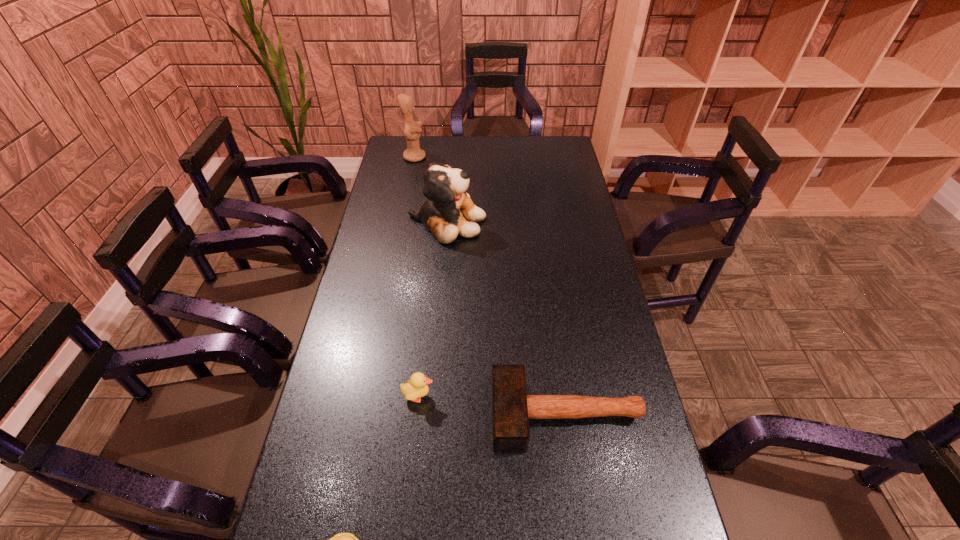
Find the location of a particular element. The width and height of the screenshot is (960, 540). free region located 0.060m on the hammer head face of the rightmost object is located at coordinates (468, 415).

Find the location of `vacant space located on the hammer head face of the rightmost object`. vacant space located on the hammer head face of the rightmost object is located at coordinates (352, 415).

Where is `object present at the far edge`? object present at the far edge is located at coordinates (413, 153).

Identify the location of figurine situated at the left edge. (413, 153).

Where is `puppy that is at the left edge`? puppy that is at the left edge is located at coordinates (444, 213).

Find the location of a particular element. object that is at the right edge is located at coordinates (512, 408).

Locate an element on the screen. object positioned at the far left corner is located at coordinates (413, 153).

In the image, there is a desktop. Where is `vacant region at the far edge`? vacant region at the far edge is located at coordinates (463, 141).

Locate an element on the screen. vacant area at the left edge is located at coordinates (365, 260).

I want to click on blank space at the right edge of the desktop, so pos(588,426).